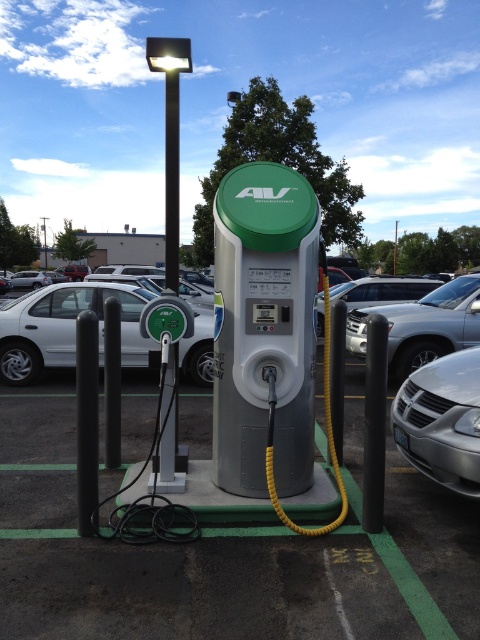
You are standing at the entrance of the parking lot and want to park your car next to the Aerovironment charging station. There are two cars already parked there. Which car is closer to the charging station, the white matte sedan at left or the silver metallic car at lower right?

The white matte sedan at left is to the left of the silver metallic car at lower right, so the silver metallic car at lower right is closer to the charging station.

You are a parking attendant and need to park a new car that is 1.8 meters tall. The white matte sedan at left and the silver metallic car at lower right are already parked. Which car should you move to accommodate the new car?

The white matte sedan at left is much taller than the silver metallic car at lower right, so you should move the silver metallic car at lower right to accommodate the new car since it is shorter.

You are a delivery driver who needs to park your truck between the white matte sedan at left and the metallic pole at upper center. The truck is 12 meters long. Is there enough space between them to park your truck?

The distance between the white matte sedan at left and the metallic pole at upper center is 55.58 meters. Since the truck is only 12 meters long, there is ample space to park between them.